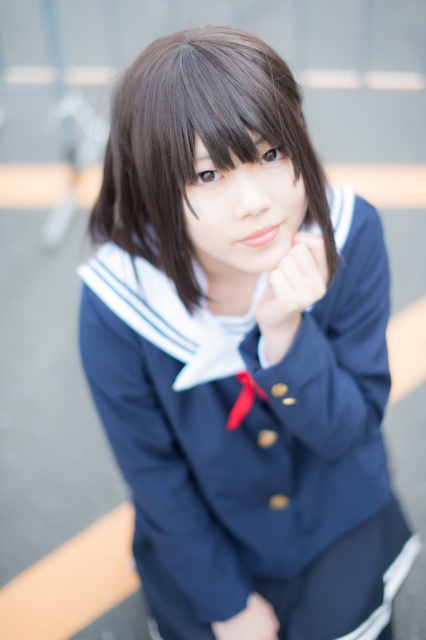
You are an artist sketching this scene. You need to ensure the proportions of the hands are accurate. Which hand, the matte skin hand at center or the matte skin hand at lower center, should you draw larger?

The matte skin hand at center should be drawn larger because it is taller than the matte skin hand at lower center.

You are an artist sketching the person in the image. You notice two hands. The first is the matte skin hand at center, and the second is the matte skin hand at lower center. Which hand should you draw larger in your sketch?

You should draw the matte skin hand at center larger than the matte skin hand at lower center because the matte skin hand at center has a larger size compared to matte skin hand at lower center.